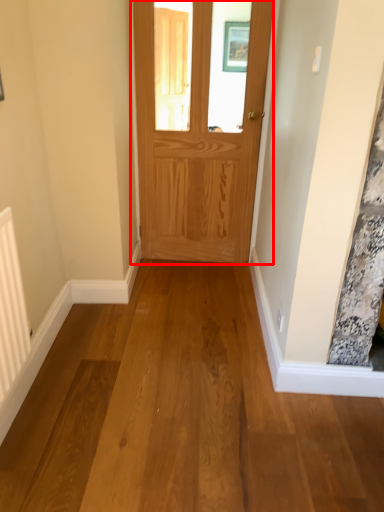
Question: Where is door (annotated by the red box) located in relation to radiator in the image?

Choices:
 (A) right
 (B) left

Answer: (A)